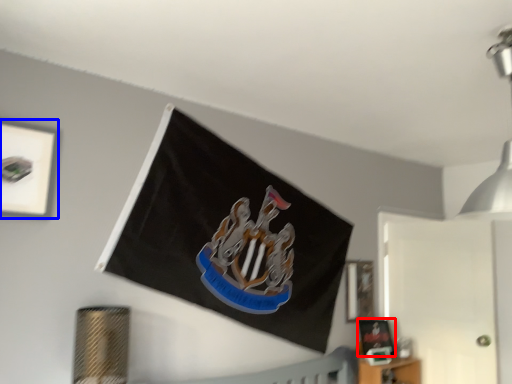
Question: Which object is further to the camera taking this photo, picture frame (highlighted by a red box) or picture frame (highlighted by a blue box)?

Choices:
 (A) picture frame
 (B) picture frame

Answer: (A)